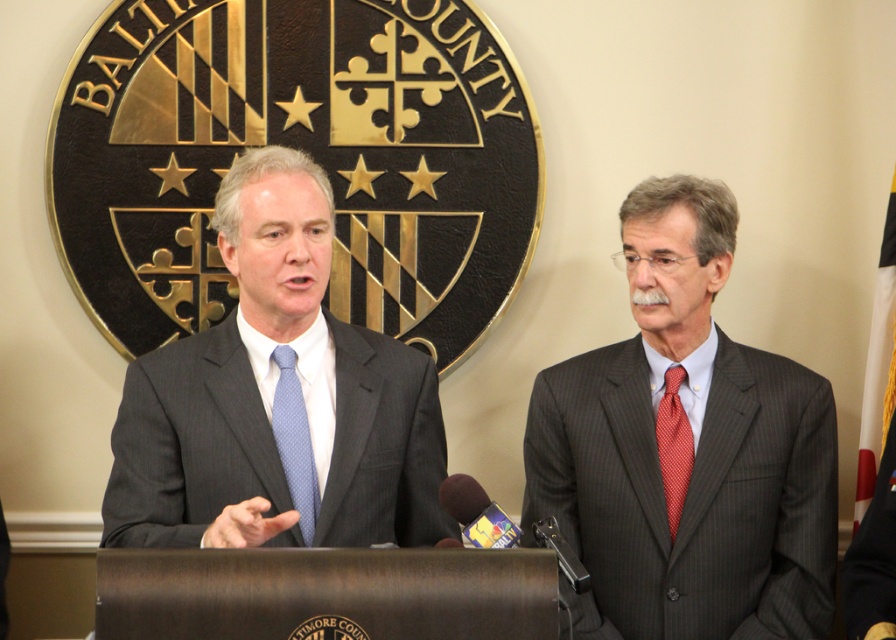
Question: Is dark gray pinstripe suit at right wider than matte gray suit at center?

Choices:
 (A) yes
 (B) no

Answer: (B)

Question: Which object is farther from the camera taking this photo?

Choices:
 (A) dark gray pinstripe suit at right
 (B) metallic silver microphone at center

Answer: (A)

Question: Is matte gray suit at center positioned before red textured tie at right?

Choices:
 (A) no
 (B) yes

Answer: (B)

Question: Which object is farther from the camera taking this photo?

Choices:
 (A) red textured tie at right
 (B) matte gray suit at center
 (C) dark gray pinstripe suit at right

Answer: (A)

Question: Which is farther from the red textured tie at right?

Choices:
 (A) metallic silver microphone at center
 (B) dark gray pinstripe suit at right
 (C) blue dotted tie at center

Answer: (A)

Question: Considering the relative positions of dark gray pinstripe suit at right and blue dotted tie at center in the image provided, where is dark gray pinstripe suit at right located with respect to blue dotted tie at center?

Choices:
 (A) above
 (B) below

Answer: (A)